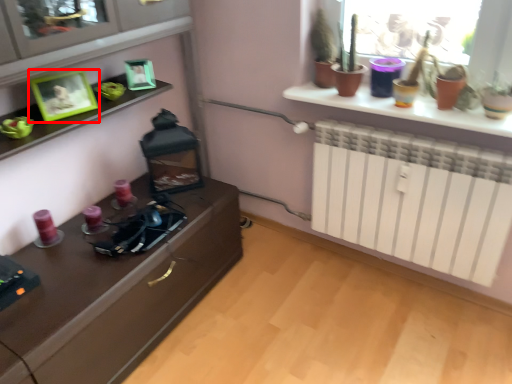
Question: From the image's perspective, where is picture frame (annotated by the red box) located in relation to picture frame in the image?

Choices:
 (A) below
 (B) above

Answer: (A)